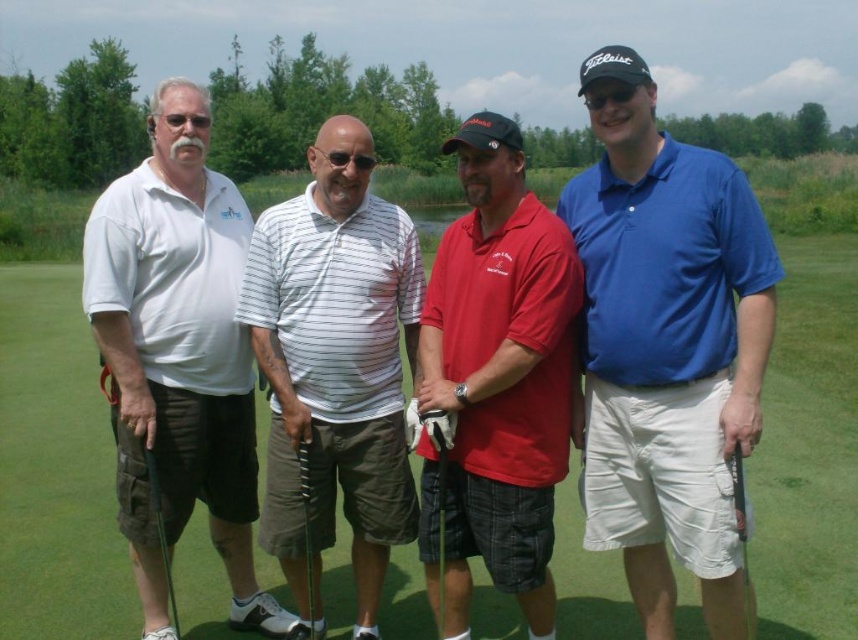
Is white matte golf club at left taller than black metallic golf club at right?

Yes, white matte golf club at left is taller than black metallic golf club at right.

Can you confirm if white matte golf club at left is positioned to the left of black metallic golf club at right?

Indeed, white matte golf club at left is positioned on the left side of black metallic golf club at right.

Is point (212, 432) farther from viewer compared to point (741, 502)?

Yes, it is.

Identify the location of white matte golf club at left. (178, 355).

Does blue cotton polo shirt at center have a lesser height compared to red cotton polo shirt at center?

In fact, blue cotton polo shirt at center may be taller than red cotton polo shirt at center.

Which is more to the right, blue cotton polo shirt at center or red cotton polo shirt at center?

blue cotton polo shirt at center is more to the right.

Measure the distance between point (702, 592) and camera.

Point (702, 592) and camera are 3.25 meters apart from each other.

At what (x,y) coordinates should I click in order to perform the action: click on blue cotton polo shirt at center. Please return your answer as a coordinate pair (x, y). Looking at the image, I should click on (666, 344).

Who is more distant from viewer, (52, 461) or (747, 580)?

Positioned behind is point (52, 461).

Which of these two, green grass at center or black metallic golf club at right, stands taller?

With more height is green grass at center.

Does point (780, 608) come closer to viewer compared to point (740, 499)?

No.

Where is `green grass at center`? green grass at center is located at coordinates (55, 468).